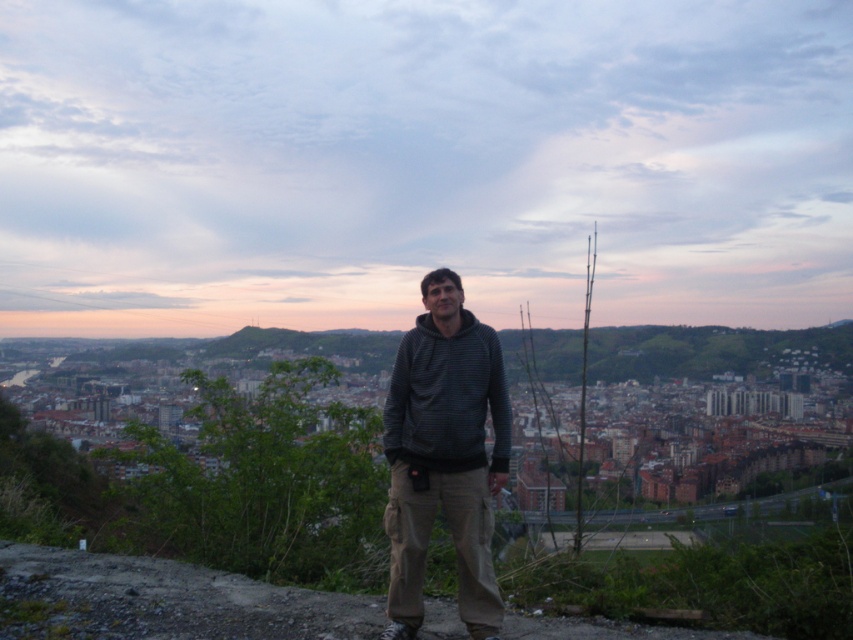
Does dark gray hoodie at center come in front of dark gray striped hoodie at center?

Yes, it is.

Can you confirm if dark gray hoodie at center is thinner than dark gray striped hoodie at center?

Correct, dark gray hoodie at center's width is less than dark gray striped hoodie at center's.

What do you see at coordinates (444, 456) in the screenshot? I see `dark gray hoodie at center` at bounding box center [444, 456].

Image resolution: width=853 pixels, height=640 pixels. Identify the location of dark gray hoodie at center. (444, 456).